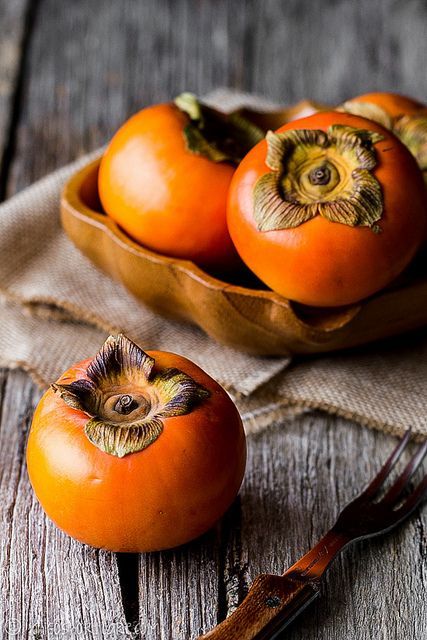
Find the location of `placemat folded`. placemat folded is located at coordinates (21, 305), (44, 297), (43, 310).